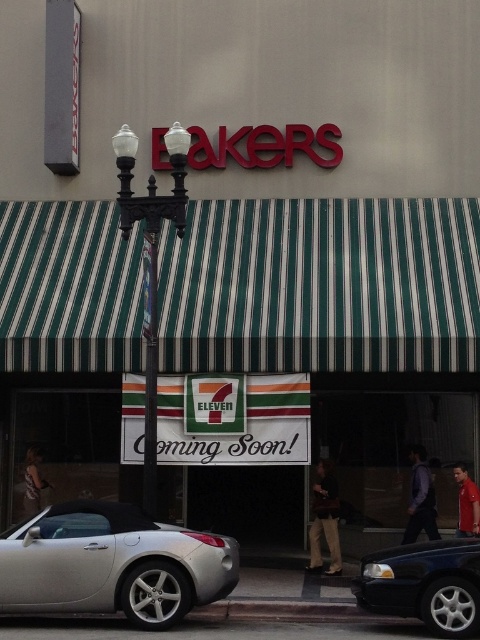
You are a delivery person who needs to park a 1.8 meter tall delivery box. You see a silver metallic convertible at lower left and a shiny black sedan at lower right. Which vehicle can accommodate the height of the delivery box without obstruction?

The silver metallic convertible at lower left has a greater height compared to shiny black sedan at lower right, so it can accommodate the 1.8 meter tall delivery box without obstruction.

You are a pedestrian standing in front of the building and want to cross the street to the other side. You see the shiny black sedan at lower right and the metallic streetlamp at center. Which object is closer to the street you are currently on?

The shiny black sedan at lower right is positioned on the right side of metallic streetlamp at center, so the metallic streetlamp at center is closer to the street you are currently on.